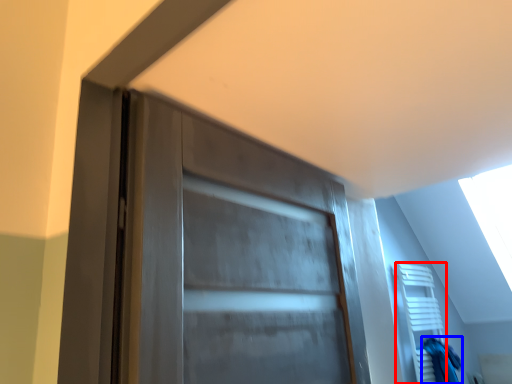
Question: Which of the following is the farthest to the observer, shelf (highlighted by a red box) or scrub (highlighted by a blue box)?

Choices:
 (A) shelf
 (B) scrub

Answer: (B)